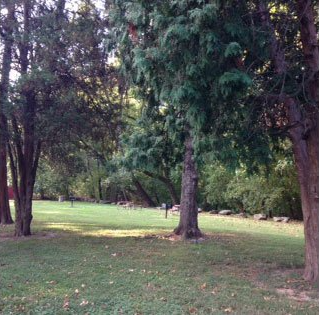
Where is `wall`? The width and height of the screenshot is (319, 315). wall is located at coordinates (9, 192).